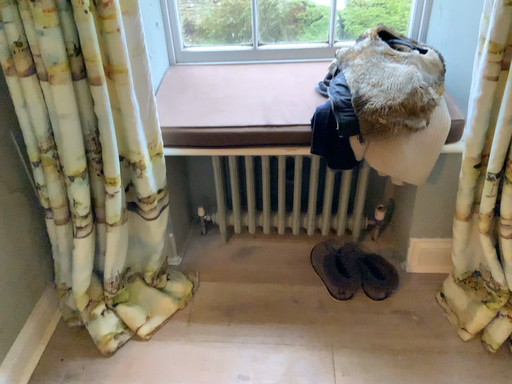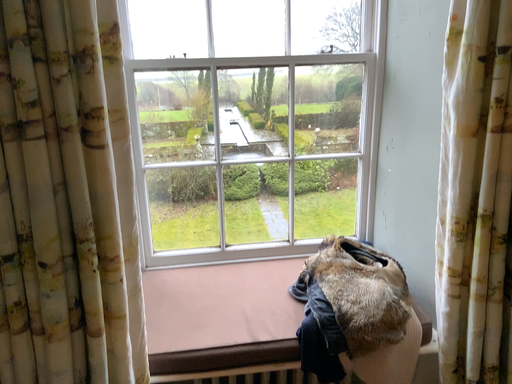
Question: Which way did the camera rotate in the video?

Choices:
 (A) rotated downward
 (B) rotated upward

Answer: (B)